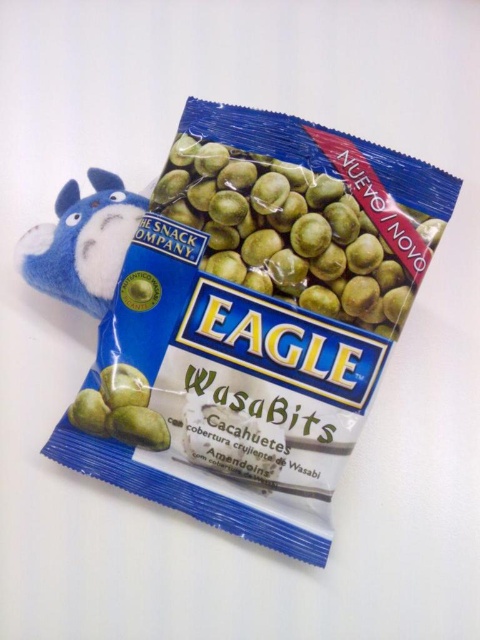
Question: Which of the following is the farthest from the observer?

Choices:
 (A) blue plush toy at upper left
 (B) green matte wasabits at center

Answer: (A)

Question: Is green matte wasabits at center thinner than blue plush toy at upper left?

Choices:
 (A) yes
 (B) no

Answer: (B)

Question: Which point is farther to the camera?

Choices:
 (A) blue plush toy at upper left
 (B) green matte wasabits at center

Answer: (A)

Question: Is green matte wasabits at center to the left of blue plush toy at upper left from the viewer's perspective?

Choices:
 (A) yes
 (B) no

Answer: (B)

Question: Is green matte wasabits at center positioned in front of blue plush toy at upper left?

Choices:
 (A) yes
 (B) no

Answer: (A)